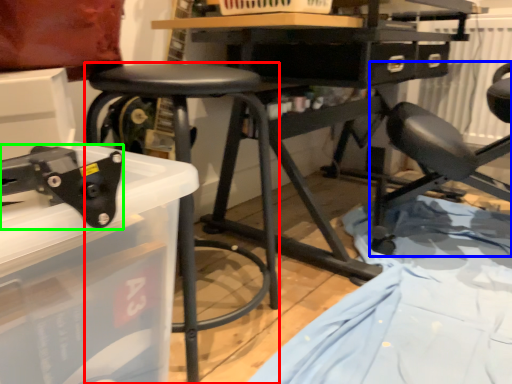
Question: Based on their relative distances, which object is farther from stool (highlighted by a red box)? Choose from chair (highlighted by a blue box) and tool (highlighted by a green box).

Choices:
 (A) chair
 (B) tool

Answer: (A)